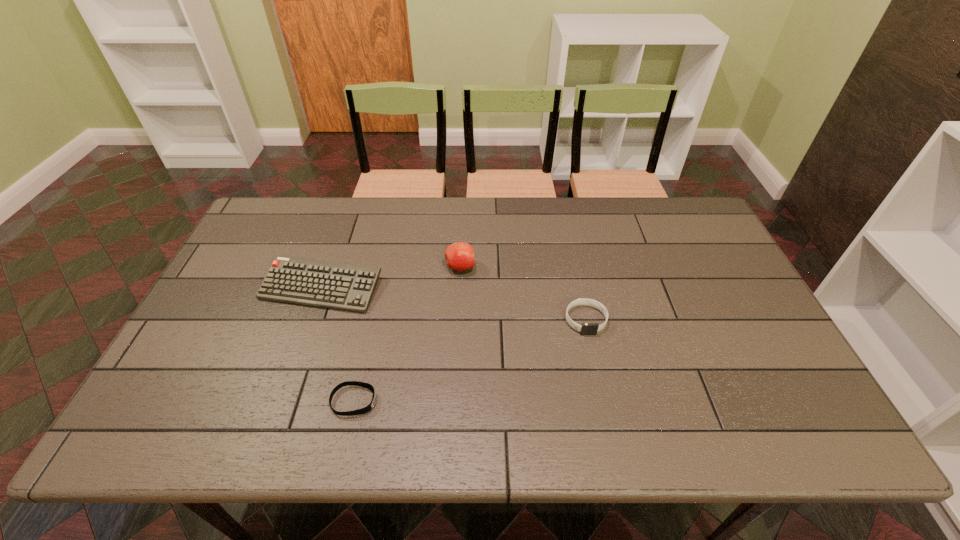
Locate an element on the screen. The width and height of the screenshot is (960, 540). free space located 0.270m on the display of the nearer wristband is located at coordinates (493, 401).

The width and height of the screenshot is (960, 540). What are the coordinates of `object located in the near edge section of the desktop` in the screenshot? It's located at (368, 408).

The height and width of the screenshot is (540, 960). Identify the location of object situated at the left edge. (345, 286).

The width and height of the screenshot is (960, 540). In order to click on blank space at the far edge of the desktop in this screenshot , I will do `click(405, 207)`.

Where is `vacant point at the left edge`? vacant point at the left edge is located at coordinates (242, 262).

This screenshot has height=540, width=960. What are the coordinates of `vacant area at the right edge` in the screenshot? It's located at (732, 302).

At what (x,y) coordinates should I click in order to perform the action: click on vacant space at the far left corner of the desktop. Please return your answer as a coordinate pair (x, y). Image resolution: width=960 pixels, height=540 pixels. Looking at the image, I should click on (267, 211).

In the image, there is a desktop. Where is `vacant space at the far right corner`? Image resolution: width=960 pixels, height=540 pixels. vacant space at the far right corner is located at coordinates (665, 234).

In order to click on free spot between the computer keyboard and the nearest object in this screenshot , I will do `click(338, 345)`.

Where is `unoccupied position between the shorter wristband and the third object from left to right`? The width and height of the screenshot is (960, 540). unoccupied position between the shorter wristband and the third object from left to right is located at coordinates (407, 334).